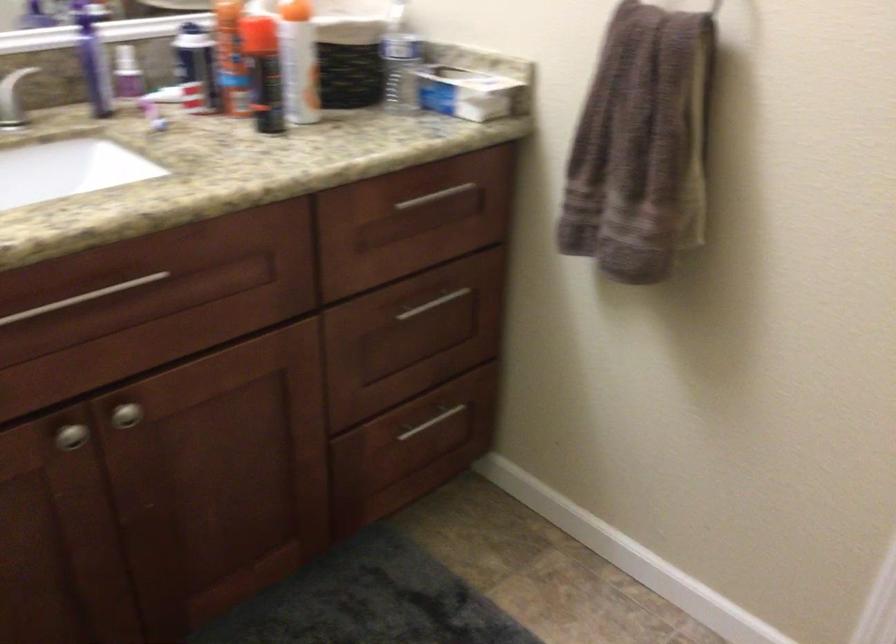
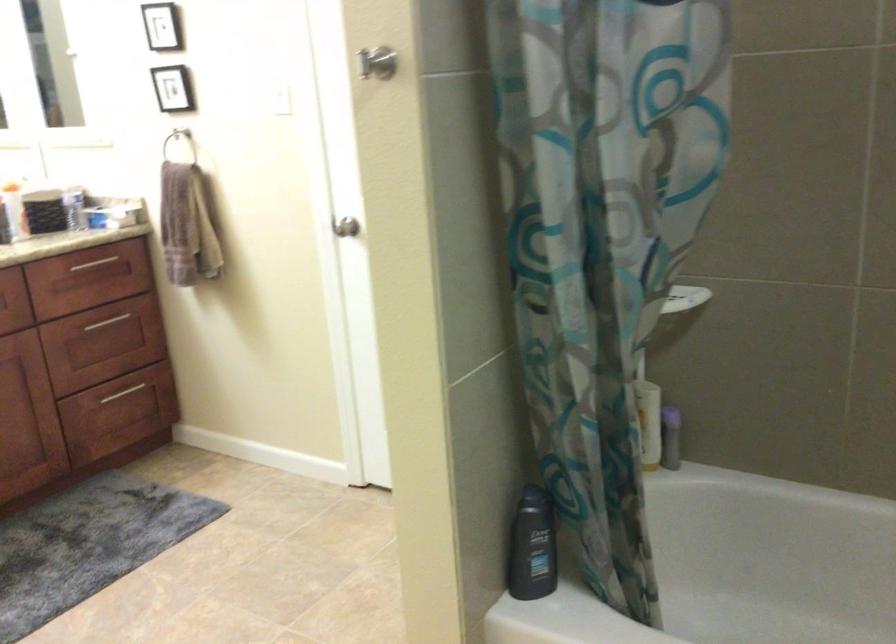
Locate, in the second image, the point that corresponds to pixel 385 80 in the first image.

(73, 207)